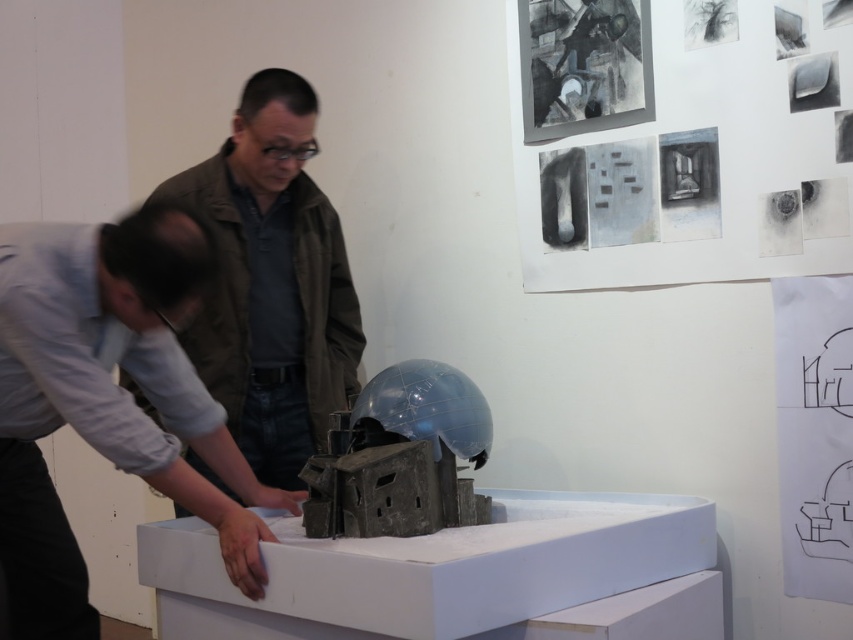
Question: Does light gray shirt at lower left appear on the left side of matte brown jacket at center?

Choices:
 (A) yes
 (B) no

Answer: (A)

Question: From the image, what is the correct spatial relationship of light gray shirt at lower left in relation to matte brown jacket at center?

Choices:
 (A) left
 (B) right

Answer: (A)

Question: Which object is farther from the camera taking this photo?

Choices:
 (A) matte brown jacket at center
 (B) light gray shirt at lower left

Answer: (A)

Question: Is light gray shirt at lower left to the left of matte brown jacket at center from the viewer's perspective?

Choices:
 (A) no
 (B) yes

Answer: (B)

Question: Which point is farther to the camera?

Choices:
 (A) light gray shirt at lower left
 (B) matte brown jacket at center

Answer: (B)